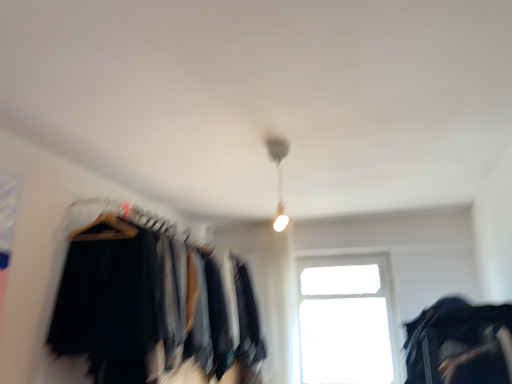
Question: Does point (344, 379) appear closer or farther from the camera than point (487, 319)?

Choices:
 (A) closer
 (B) farther

Answer: (B)

Question: Is transparent glass window at center situated inside black fabric bag at lower right or outside?

Choices:
 (A) inside
 (B) outside

Answer: (B)

Question: Estimate the real-world distances between objects in this image. Which object is farther from the black fabric bag at lower right?

Choices:
 (A) white glossy lamp at upper center
 (B) black fabric clothes at left
 (C) transparent glass window at center

Answer: (C)

Question: Estimate the real-world distances between objects in this image. Which object is closer to the black fabric bag at lower right?

Choices:
 (A) black fabric clothes at left
 (B) transparent glass window at center
 (C) white glossy lamp at upper center

Answer: (C)